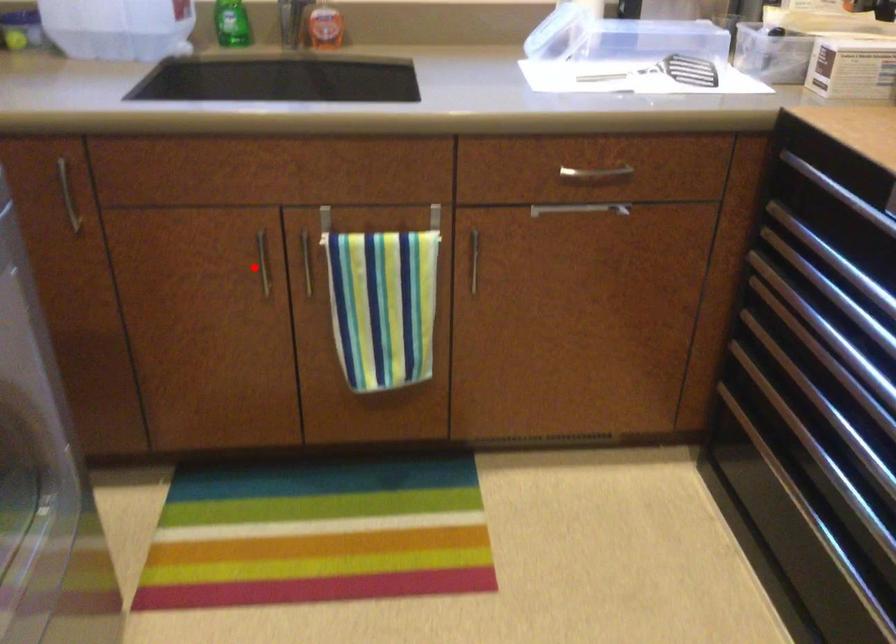
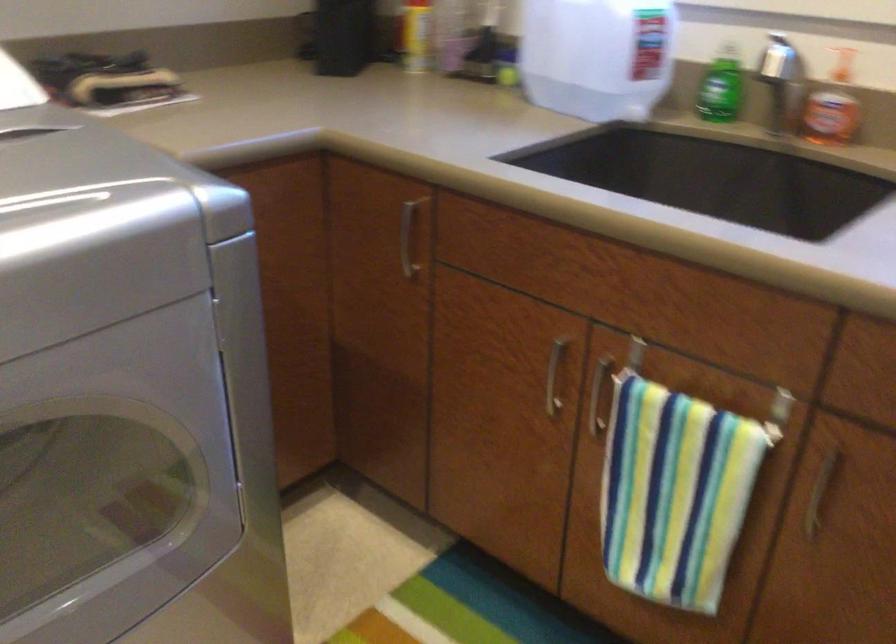
Question: I am providing you with two images of the same scene from different viewpoints. A red point is marked on the first image. Is the red point's position out of view in image 2?

Choices:
 (A) Yes
 (B) No

Answer: (B)